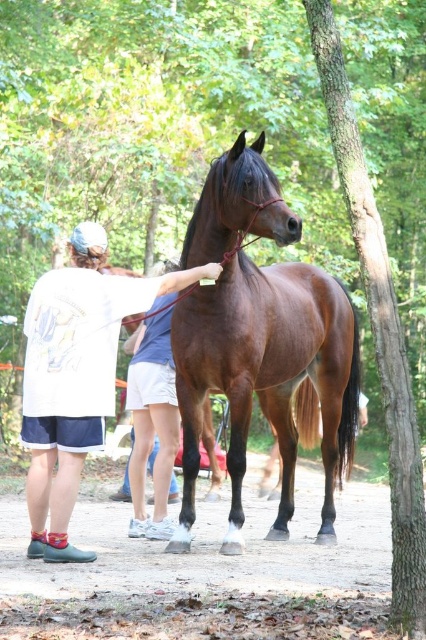
Does brown glossy horse at center come behind white cotton shirt at left?

No, brown glossy horse at center is in front of white cotton shirt at left.

Who is lower down, brown glossy horse at center or white cotton shirt at left?

Positioned lower is white cotton shirt at left.

You are a GUI agent. You are given a task and a screenshot of the screen. Output one action in this format:
    pyautogui.click(x=<x>, y=<y>)
    Task: Click on the brown glossy horse at center
    
    Given the screenshot: What is the action you would take?
    coord(267,378)